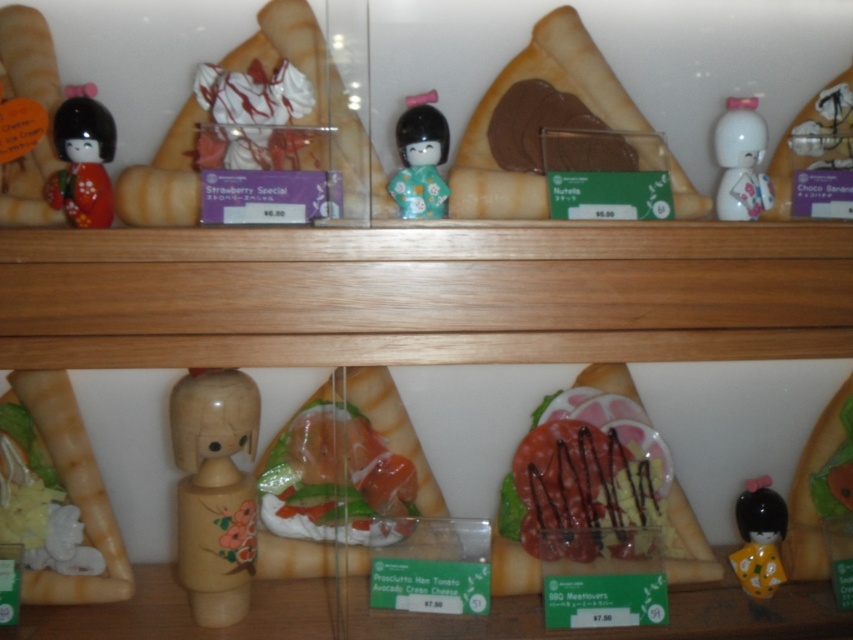
You are a customer at the Japanese cafe and want to point out the two figurines to the staff. Which figurine is nearer to you, the matte black figurine at upper left or the white glossy figurine at upper right?

The matte black figurine at upper left is closer to the viewer than the white glossy figurine at upper right, so the matte black figurine at upper left is nearer to you.

You are a customer at a Japanese cafe and want to locate the matte black figurine at upper left. According to the display case layout, where exactly is it positioned?

The matte black figurine at upper left is positioned at point (82, 163) in the display case.

You are a delivery person who needs to place a new item at point (730, 193) in the display case. The item is 12 inches tall. Can you safely place it there without hitting the ceiling?

The distance of point (730, 193) from camera is 38.07 inches, so yes, the item can be placed there as it is shorter than the available height.